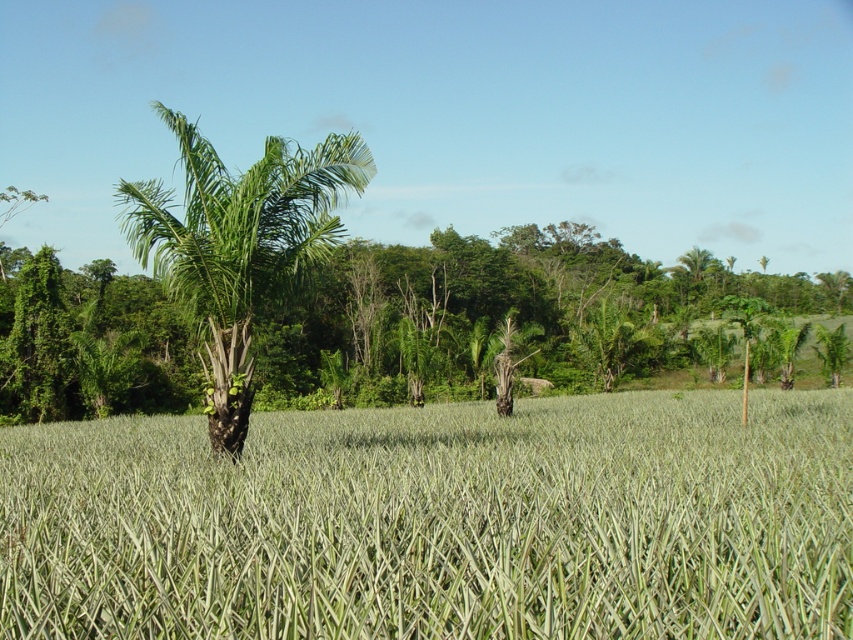
I want to click on green grassy wheat field at center, so click(438, 522).

Does point (120, 513) come behind point (244, 436)?

No, it is in front of (244, 436).

Find the location of a particular element. The image size is (853, 640). green grassy wheat field at center is located at coordinates (438, 522).